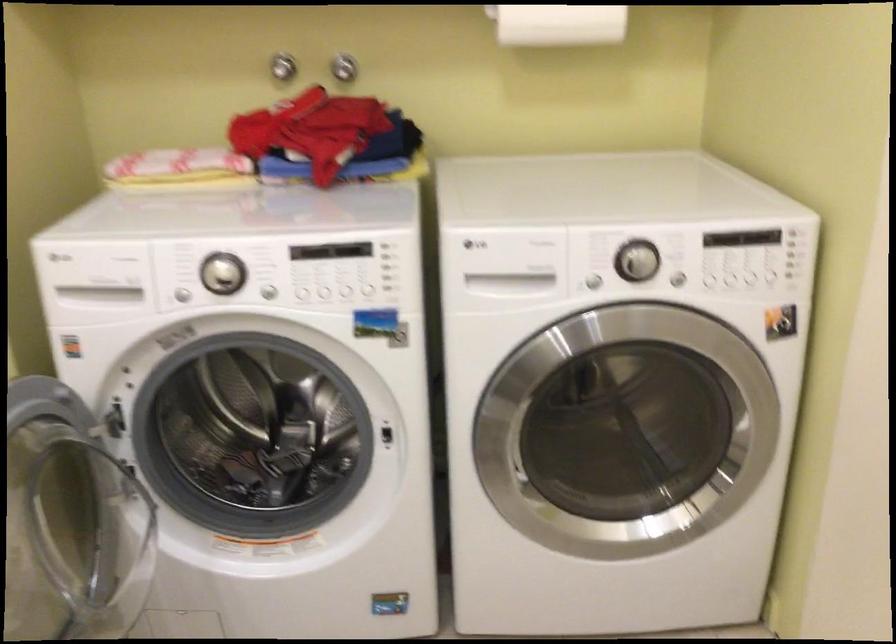
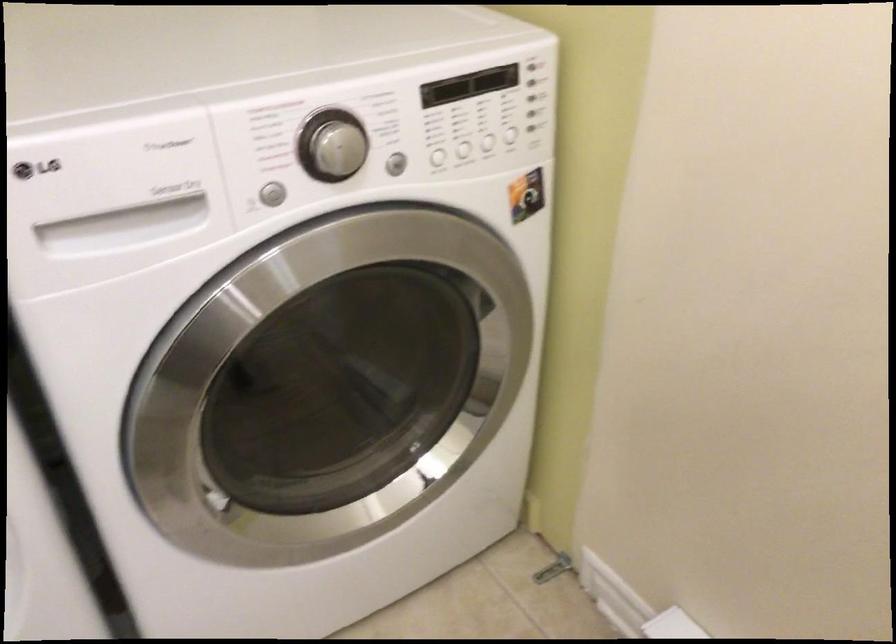
Where in the second image is the point corresponding to (531,278) from the first image?

(164, 210)